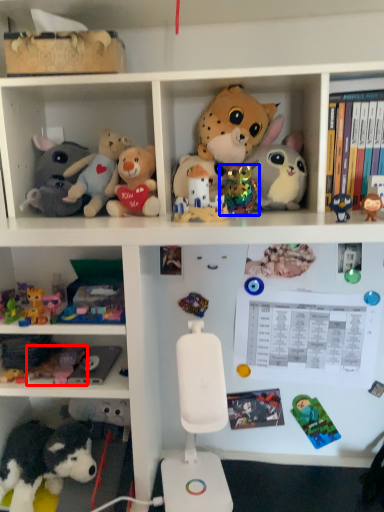
Question: Which of the following is the farthest to the observer, toy (highlighted by a red box) or toy (highlighted by a blue box)?

Choices:
 (A) toy
 (B) toy

Answer: (B)